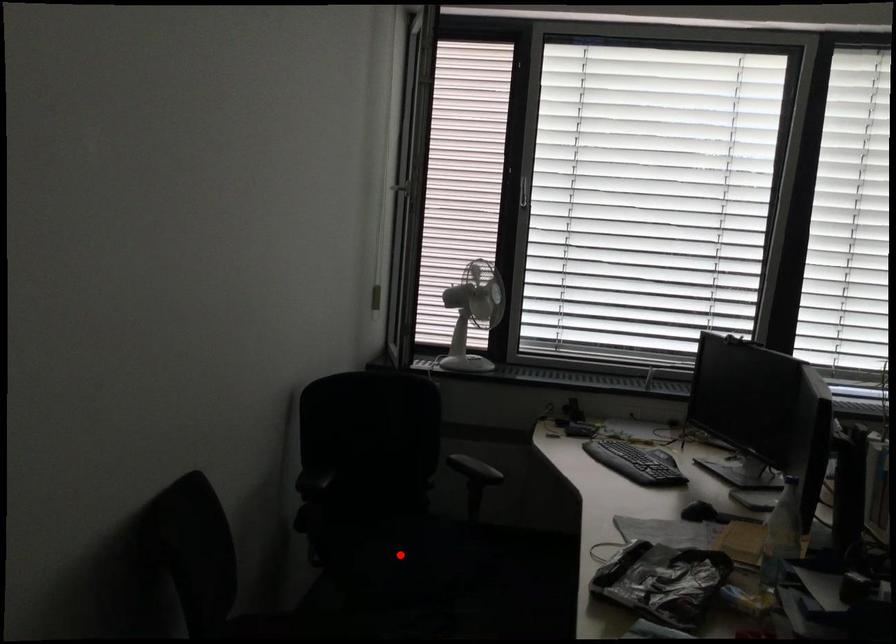
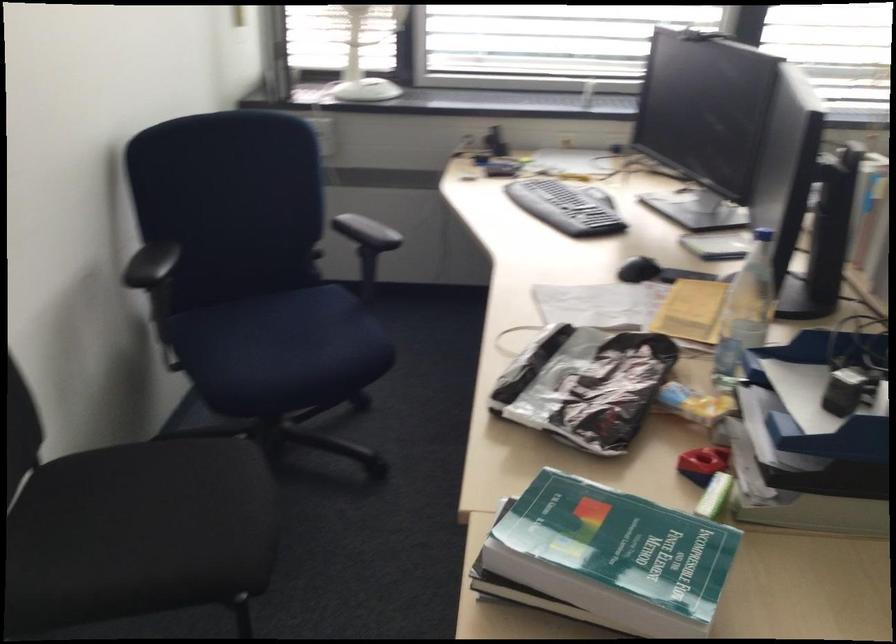
Where in the second image is the point corresponding to the highlighted location from the first image?

(278, 346)